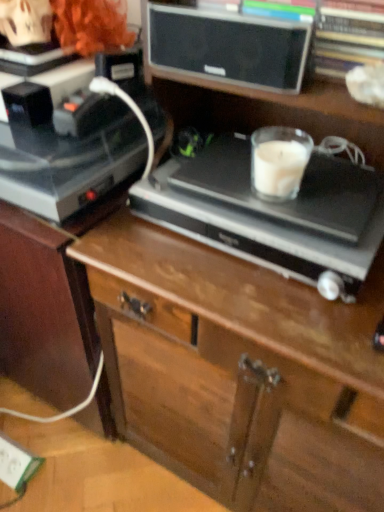
Where is `shiny black record player at left, which is the second appliance from right to left`? shiny black record player at left, which is the second appliance from right to left is located at coordinates (71, 155).

What is the approximate height of satin black record player at center, positioned as the second appliance in left-to-right order?

The height of satin black record player at center, positioned as the second appliance in left-to-right order, is 3.86 inches.

You are a GUI agent. You are given a task and a screenshot of the screen. Output one action in this format:
    pyautogui.click(x=<x>, y=<y>)
    Task: Click on the satin black record player at center, the first appliance positioned from the right
    This screenshot has width=384, height=512.
    Given the screenshot: What is the action you would take?
    pyautogui.click(x=272, y=213)

Measure the distance between point [18,489] and camera.

1.12 meters.

The image size is (384, 512). Identify the location of wooden chest of drawers at center. (238, 370).

Describe the element at coordinates (238, 370) in the screenshot. I see `wooden chest of drawers at center` at that location.

The image size is (384, 512). In order to click on shiny black record player at left, the 1th appliance viewed from the left in this screenshot , I will do `click(71, 155)`.

Is matte black speaker at upper center positioned with its back to white plastic electric outlet at lower left?

No, matte black speaker at upper center is not facing away from white plastic electric outlet at lower left.

Do you think matte black speaker at upper center is within white plastic electric outlet at lower left, or outside of it?

matte black speaker at upper center is not inside white plastic electric outlet at lower left, it's outside.

Which is farther, (241, 18) or (2, 473)?

The point (2, 473) is farther from the camera.

What's the angular difference between matte black speaker at upper center and satin black record player at center, the first appliance positioned from the right,'s facing directions?

They differ by 1.01 degrees in their facing directions.

Image resolution: width=384 pixels, height=512 pixels. What are the coordinates of `speaker on the left side of satin black record player at center, the first appliance positioned from the right` in the screenshot? It's located at tap(228, 47).

From the image's perspective, which object appears higher, matte black speaker at upper center or satin black record player at center, positioned as the second appliance in left-to-right order?

matte black speaker at upper center.

Is matte black speaker at upper center turned away from satin black record player at center, the first appliance positioned from the right?

No, satin black record player at center, the first appliance positioned from the right, is not at the back of matte black speaker at upper center.

Between wooden chest of drawers at center and matte black speaker at upper center, which one is positioned behind?

matte black speaker at upper center is behind.

Is wooden chest of drawers at center surrounding matte black speaker at upper center?

Indeed, matte black speaker at upper center is located within wooden chest of drawers at center.

From their relative heights in the image, would you say wooden chest of drawers at center is taller or shorter than matte black speaker at upper center?

Clearly, wooden chest of drawers at center is taller compared to matte black speaker at upper center.

Does point (131, 244) appear closer or farther from the camera than point (225, 45)?

Point (131, 244).

Does matte black speaker at upper center come behind wooden chest of drawers at center?

Yes, it is behind wooden chest of drawers at center.

Which is more to the left, matte black speaker at upper center or wooden chest of drawers at center?

matte black speaker at upper center.

Who is bigger, matte black speaker at upper center or wooden chest of drawers at center?

wooden chest of drawers at center.

Is white plastic electric outlet at lower left in front of or behind wooden chest of drawers at center in the image?

Clearly, white plastic electric outlet at lower left is behind wooden chest of drawers at center.

Is white plastic electric outlet at lower left facing away from wooden chest of drawers at center?

white plastic electric outlet at lower left is not turned away from wooden chest of drawers at center.

Between white plastic electric outlet at lower left and wooden chest of drawers at center, which one has less height?

white plastic electric outlet at lower left.

Would you say wooden chest of drawers at center is part of white plastic electric outlet at lower left's contents?

No, wooden chest of drawers at center is not inside white plastic electric outlet at lower left.

Considering the sizes of objects shiny black record player at left, which is the second appliance from right to left, and matte black speaker at upper center in the image provided, who is smaller, shiny black record player at left, which is the second appliance from right to left, or matte black speaker at upper center?

matte black speaker at upper center is smaller.

From a real-world perspective, which is physically below, shiny black record player at left, which is the second appliance from right to left, or matte black speaker at upper center?

shiny black record player at left, which is the second appliance from right to left.

How distant is shiny black record player at left, the 1th appliance viewed from the left, from matte black speaker at upper center?

A distance of 8.99 inches exists between shiny black record player at left, the 1th appliance viewed from the left, and matte black speaker at upper center.

Based on the photo, considering their positions, is shiny black record player at left, the 1th appliance viewed from the left, located in front of or behind matte black speaker at upper center?

shiny black record player at left, the 1th appliance viewed from the left, is behind matte black speaker at upper center.

From a real-world perspective, which object rests below the other?

In real-world perspective, wooden chest of drawers at center is lower.

From the image's perspective, relative to wooden chest of drawers at center, is satin black record player at center, positioned as the second appliance in left-to-right order, above or below?

From the image's perspective, satin black record player at center, positioned as the second appliance in left-to-right order, appears above wooden chest of drawers at center.

I want to click on chest of drawers on the right of satin black record player at center, the first appliance positioned from the right, so click(x=238, y=370).

Can we say satin black record player at center, positioned as the second appliance in left-to-right order, lies outside wooden chest of drawers at center?

No, satin black record player at center, positioned as the second appliance in left-to-right order, is inside or overlapping with wooden chest of drawers at center.

At what (x,y) coordinates should I click in order to perform the action: click on speaker in front of the white plastic electric outlet at lower left. Please return your answer as a coordinate pair (x, y). Looking at the image, I should click on (228, 47).

At what (x,y) coordinates should I click in order to perform the action: click on appliance on the right of matte black speaker at upper center. Please return your answer as a coordinate pair (x, y). Looking at the image, I should click on (272, 213).

From the image, which object appears to be nearer to shiny black record player at left, which is the second appliance from right to left, satin black record player at center, positioned as the second appliance in left-to-right order, or white plastic electric outlet at lower left?

satin black record player at center, positioned as the second appliance in left-to-right order, is closer to shiny black record player at left, which is the second appliance from right to left.

Looking at the image, which one is located further to wooden chest of drawers at center, white plastic electric outlet at lower left or matte black speaker at upper center?

white plastic electric outlet at lower left is positioned further to the anchor wooden chest of drawers at center.

Which object lies further to the anchor point matte black speaker at upper center, satin black record player at center, the first appliance positioned from the right, or white plastic electric outlet at lower left?

white plastic electric outlet at lower left lies further to matte black speaker at upper center than the other object.

From the image, which object appears to be nearer to wooden chest of drawers at center, matte black speaker at upper center or white plastic electric outlet at lower left?

matte black speaker at upper center lies closer to wooden chest of drawers at center than the other object.

When comparing their distances from shiny black record player at left, the 1th appliance viewed from the left, does wooden chest of drawers at center or satin black record player at center, the first appliance positioned from the right, seem closer?

satin black record player at center, the first appliance positioned from the right, is positioned closer to the anchor shiny black record player at left, the 1th appliance viewed from the left.

Considering their positions, is matte black speaker at upper center positioned further to white plastic electric outlet at lower left than satin black record player at center, positioned as the second appliance in left-to-right order?

Among the two, matte black speaker at upper center is located further to white plastic electric outlet at lower left.

Looking at the image, which one is located further to satin black record player at center, positioned as the second appliance in left-to-right order, wooden chest of drawers at center or white plastic electric outlet at lower left?

Among the two, white plastic electric outlet at lower left is located further to satin black record player at center, positioned as the second appliance in left-to-right order.

From the picture: Based on their spatial positions, is white plastic electric outlet at lower left or shiny black record player at left, which is the second appliance from right to left, further from matte black speaker at upper center?

white plastic electric outlet at lower left.

Where is `appliance that lies between shiny black record player at left, the 1th appliance viewed from the left, and white plastic electric outlet at lower left from top to bottom`? Image resolution: width=384 pixels, height=512 pixels. appliance that lies between shiny black record player at left, the 1th appliance viewed from the left, and white plastic electric outlet at lower left from top to bottom is located at coordinates (272, 213).

I want to click on the chest of drawers that lies between shiny black record player at left, which is the second appliance from right to left, and white plastic electric outlet at lower left from top to bottom, so click(238, 370).

At what (x,y) coordinates should I click in order to perform the action: click on appliance between shiny black record player at left, which is the second appliance from right to left, and wooden chest of drawers at center. Please return your answer as a coordinate pair (x, y). The height and width of the screenshot is (512, 384). Looking at the image, I should click on (272, 213).

Where is `speaker situated between shiny black record player at left, the 1th appliance viewed from the left, and wooden chest of drawers at center from left to right`? This screenshot has height=512, width=384. speaker situated between shiny black record player at left, the 1th appliance viewed from the left, and wooden chest of drawers at center from left to right is located at coordinates (228, 47).